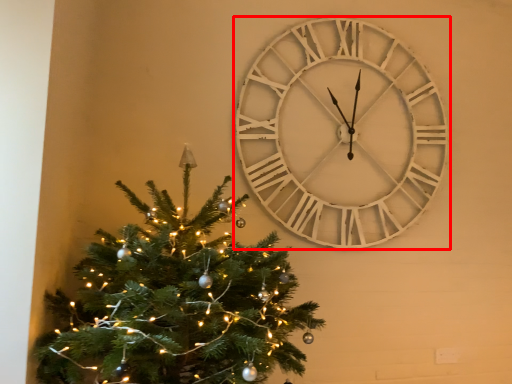
Question: Where is wall clock (annotated by the red box) located in relation to christmas tree in the image?

Choices:
 (A) right
 (B) left

Answer: (A)